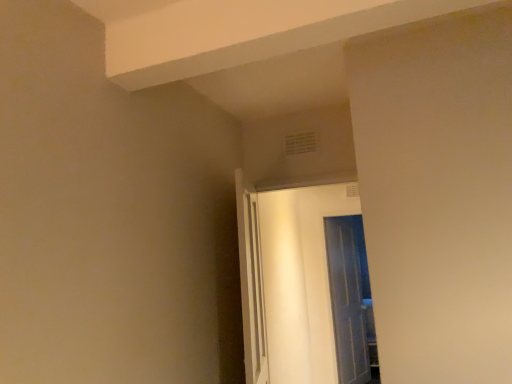
Question: Is clear glass door at center, acting as the second door starting from the front, oriented towards white glossy door at center, which is counted as the first door, starting from the left?

Choices:
 (A) no
 (B) yes

Answer: (A)

Question: Considering the relative sizes of clear glass door at center, acting as the 1th door starting from the right, and white glossy door at center, the 2th door from the right, in the image provided, is clear glass door at center, acting as the 1th door starting from the right, shorter than white glossy door at center, the 2th door from the right,?

Choices:
 (A) yes
 (B) no

Answer: (B)

Question: From the image's perspective, does clear glass door at center, acting as the 1th door starting from the right, appear lower than white glossy door at center, which is the 1th door in front-to-back order?

Choices:
 (A) no
 (B) yes

Answer: (B)

Question: Is clear glass door at center, positioned as the 1th door in back-to-front order, with white glossy door at center, which is the 1th door in front-to-back order?

Choices:
 (A) no
 (B) yes

Answer: (A)

Question: Is clear glass door at center, acting as the 1th door starting from the right, further to camera compared to white glossy door at center, which is the second door from back to front?

Choices:
 (A) yes
 (B) no

Answer: (A)

Question: Is clear glass door at center, placed as the 2th door when sorted from left to right, closer to the viewer compared to white glossy door at center, which is the second door from back to front?

Choices:
 (A) yes
 (B) no

Answer: (B)

Question: From a real-world perspective, is white glossy door at center, which is the second door from back to front, on top of clear glass door at center, positioned as the 1th door in back-to-front order?

Choices:
 (A) yes
 (B) no

Answer: (A)

Question: Does white glossy door at center, which is counted as the first door, starting from the left, have a lesser height compared to clear glass door at center, placed as the 2th door when sorted from left to right?

Choices:
 (A) no
 (B) yes

Answer: (B)

Question: Is white glossy door at center, which is the second door from back to front, to the right of clear glass door at center, placed as the 2th door when sorted from left to right, from the viewer's perspective?

Choices:
 (A) no
 (B) yes

Answer: (A)

Question: From a real-world perspective, is white glossy door at center, which is the 1th door in front-to-back order, positioned under clear glass door at center, positioned as the 1th door in back-to-front order, based on gravity?

Choices:
 (A) no
 (B) yes

Answer: (A)

Question: Is the position of white glossy door at center, the 2th door from the right, less distant than that of clear glass door at center, positioned as the 1th door in back-to-front order?

Choices:
 (A) yes
 (B) no

Answer: (A)

Question: Is white glossy door at center, which is the second door from back to front, not near clear glass door at center, positioned as the 1th door in back-to-front order?

Choices:
 (A) yes
 (B) no

Answer: (B)

Question: Does point [x=330, y=249] appear closer or farther from the camera than point [x=287, y=253]?

Choices:
 (A) closer
 (B) farther

Answer: (B)